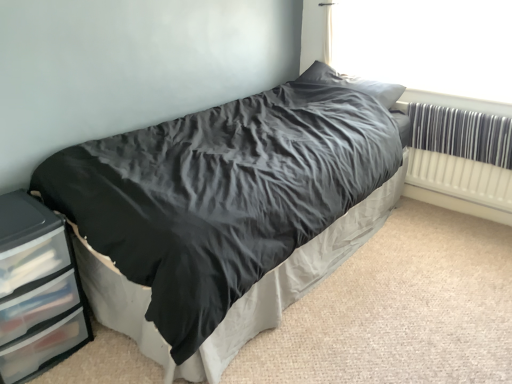
Question: From a real-world perspective, is matte black bed at center positioned above or below satin gray pillow at upper center?

Choices:
 (A) above
 (B) below

Answer: (B)

Question: Based on their sizes in the image, would you say matte black bed at center is bigger or smaller than satin gray pillow at upper center?

Choices:
 (A) big
 (B) small

Answer: (A)

Question: Which object is the farthest from the white plastic radiator at right?

Choices:
 (A) transparent plastic window screen at upper right
 (B) satin gray pillow at upper center
 (C) clear plastic chest of drawers at lower left
 (D) matte black bed at center

Answer: (C)

Question: Based on their relative distances, which object is farther from the satin gray pillow at upper center?

Choices:
 (A) clear plastic chest of drawers at lower left
 (B) white plastic radiator at right
 (C) matte black bed at center
 (D) transparent plastic window screen at upper right

Answer: (A)